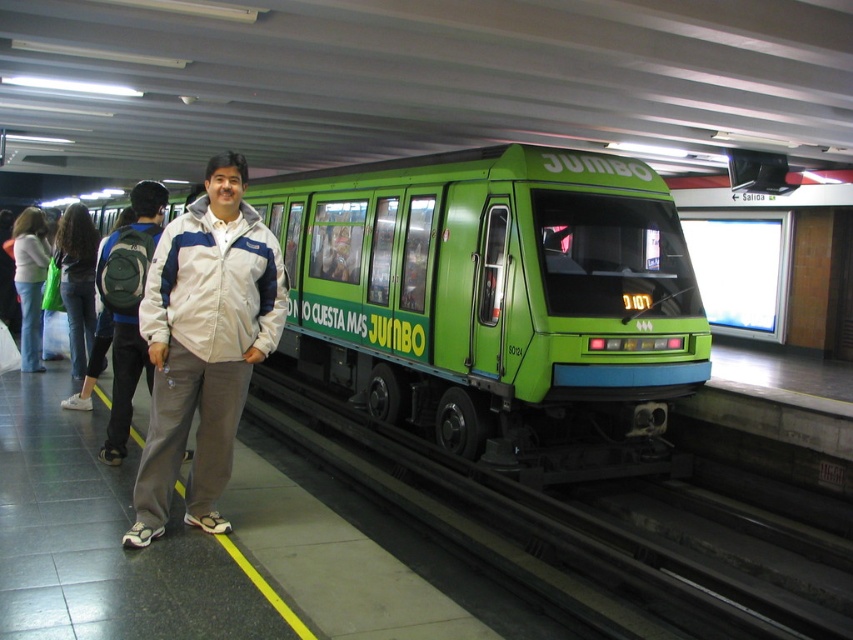
Question: Which object is closer to the camera taking this photo?

Choices:
 (A) green matte train at center
 (B) denim jeans at left
 (C) denim jacket at left
 (D) white fabric jacket at center

Answer: (D)

Question: Which point appears closest to the camera in this image?

Choices:
 (A) (154, 476)
 (B) (32, 209)
 (C) (526, 342)

Answer: (A)

Question: Is denim jeans at left to the left of denim jacket at left from the viewer's perspective?

Choices:
 (A) no
 (B) yes

Answer: (A)

Question: Which point appears closest to the camera in this image?

Choices:
 (A) (64, 243)
 (B) (173, 317)

Answer: (B)

Question: Is green matte train at center wider than denim jacket at left?

Choices:
 (A) no
 (B) yes

Answer: (B)

Question: Does green matte train at center have a lesser width compared to white fabric jacket at center?

Choices:
 (A) no
 (B) yes

Answer: (B)